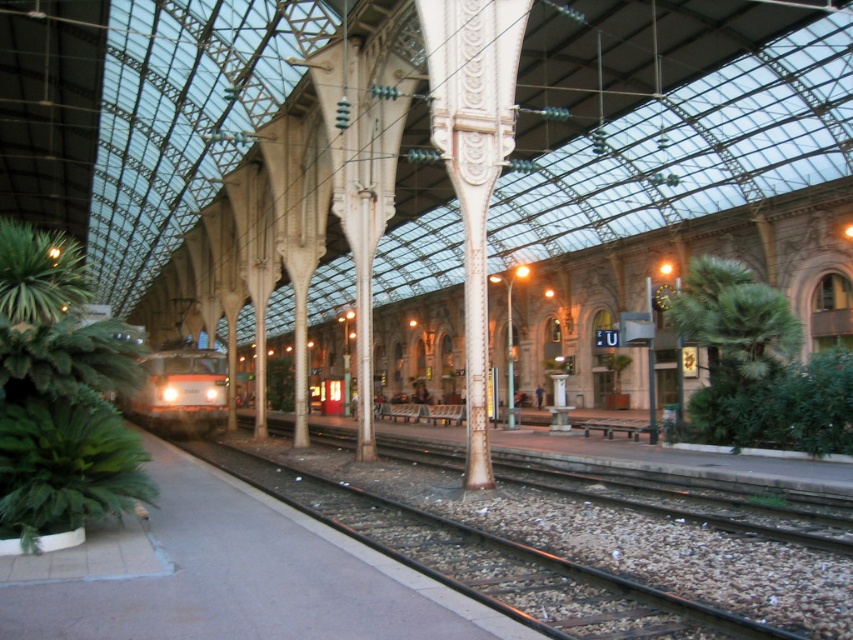
You are a passenger waiting at the train station and see the green leafy plant at lower left and the orange metallic train at center. Which object is positioned higher in the scene?

The green leafy plant at lower left is positioned higher than the orange metallic train at center in the scene.

From the picture: You are standing at the center of the train station platform. You see a point marked at coordinates (758, 365). What object is this point located on?

The point at coordinates (758, 365) is located on the green leafy plant at right.